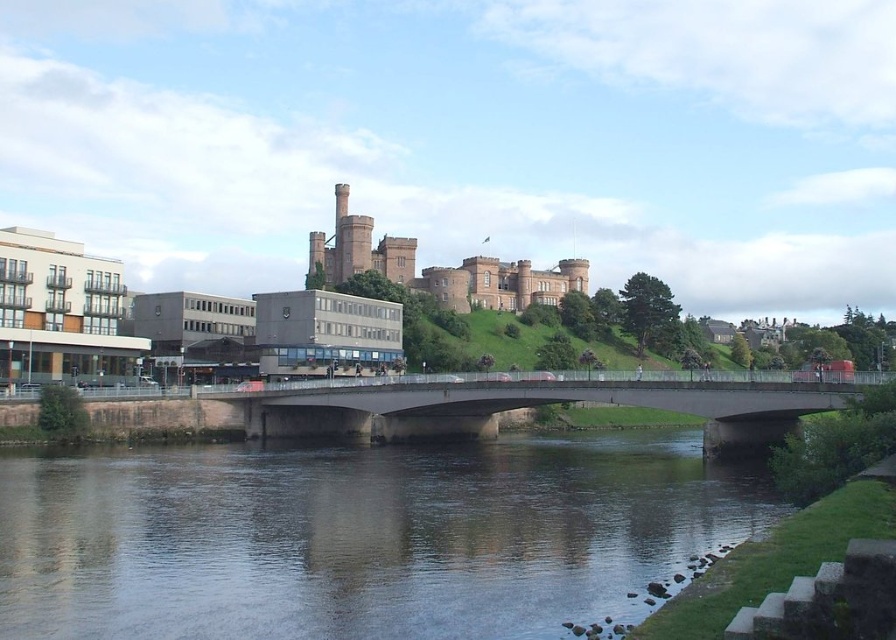
Question: Does dark gray water at center have a lesser width compared to concrete bridge at center?

Choices:
 (A) yes
 (B) no

Answer: (B)

Question: Is dark gray water at center smaller than concrete bridge at center?

Choices:
 (A) yes
 (B) no

Answer: (A)

Question: Which point is closer to the camera?

Choices:
 (A) (330, 497)
 (B) (712, 428)

Answer: (A)

Question: Can you confirm if dark gray water at center is positioned to the right of concrete bridge at center?

Choices:
 (A) no
 (B) yes

Answer: (A)